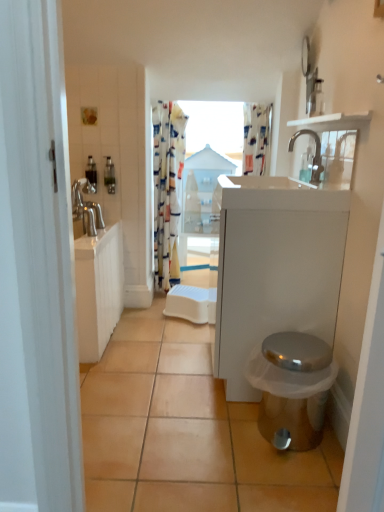
Question: Can you confirm if silver metallic faucet at upper center is thinner than white wood shelf at upper right?

Choices:
 (A) no
 (B) yes

Answer: (A)

Question: From a real-world perspective, does silver metallic faucet at upper center sit lower than white wood shelf at upper right?

Choices:
 (A) no
 (B) yes

Answer: (B)

Question: Can you confirm if silver metallic faucet at upper center is bigger than white wood shelf at upper right?

Choices:
 (A) yes
 (B) no

Answer: (B)

Question: Is silver metallic faucet at upper center aimed at white wood shelf at upper right?

Choices:
 (A) yes
 (B) no

Answer: (B)

Question: From the image's perspective, is silver metallic faucet at upper center over white wood shelf at upper right?

Choices:
 (A) yes
 (B) no

Answer: (B)

Question: Does silver metallic faucet at upper center have a lesser height compared to white wood shelf at upper right?

Choices:
 (A) no
 (B) yes

Answer: (A)

Question: Is white wood shelf at upper right aimed at floral fabric curtain at center?

Choices:
 (A) no
 (B) yes

Answer: (A)

Question: From the image's perspective, is white wood shelf at upper right on floral fabric curtain at center?

Choices:
 (A) yes
 (B) no

Answer: (A)

Question: Does white wood shelf at upper right lie behind floral fabric curtain at center?

Choices:
 (A) no
 (B) yes

Answer: (A)

Question: Is white wood shelf at upper right to the right of floral fabric curtain at center from the viewer's perspective?

Choices:
 (A) yes
 (B) no

Answer: (A)

Question: From a real-world perspective, is white wood shelf at upper right physically above floral fabric curtain at center?

Choices:
 (A) yes
 (B) no

Answer: (A)

Question: Can we say white wood shelf at upper right lies outside floral fabric curtain at center?

Choices:
 (A) no
 (B) yes

Answer: (B)

Question: From the image's perspective, is shiny metallic toilet at lower right located beneath patterned fabric shower curtain at upper center?

Choices:
 (A) no
 (B) yes

Answer: (B)